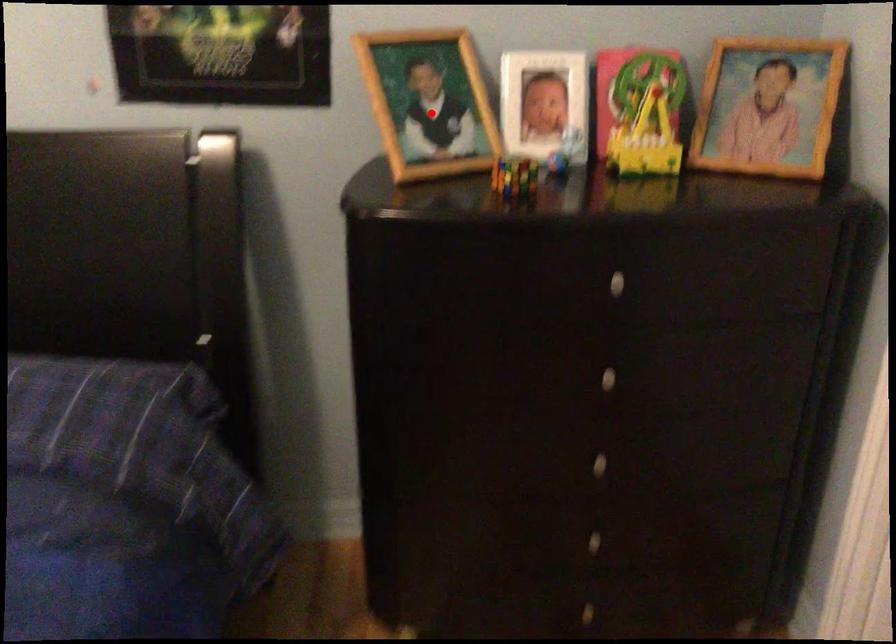
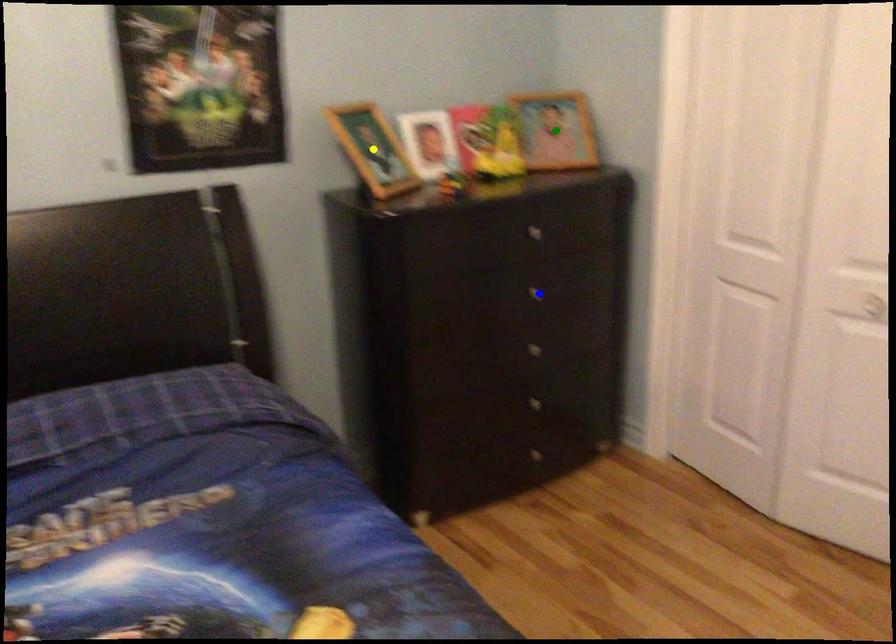
Question: I am providing you with two images of the same scene from different viewpoints. A red point is marked on the first image. You are given multiple points on the second image. Which point in image 2 is actually the same real-world point as the red point in image 1?

Choices:
 (A) blue point
 (B) green point
 (C) yellow point

Answer: (C)